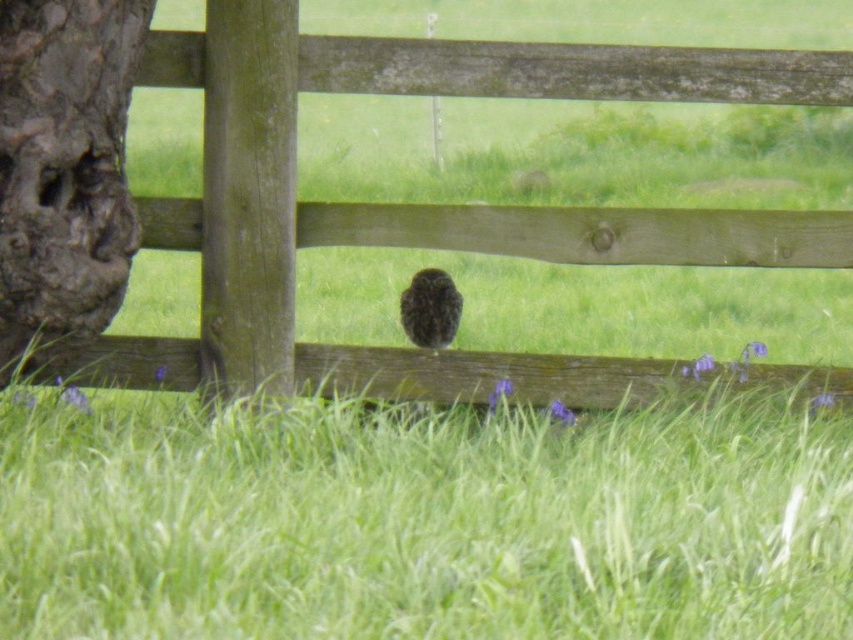
Question: Which point appears farthest from the camera in this image?

Choices:
 (A) (552, 541)
 (B) (447, 330)
 (C) (436, 376)
 (D) (93, 291)

Answer: (B)

Question: Is green grass at center to the left of rough bark tree trunk at left from the viewer's perspective?

Choices:
 (A) yes
 (B) no

Answer: (B)

Question: Which point is closer to the camera taking this photo?

Choices:
 (A) (369, 228)
 (B) (94, 76)
 (C) (440, 461)

Answer: (C)

Question: In this image, where is green grass at center located relative to rough bark tree trunk at left?

Choices:
 (A) above
 (B) below

Answer: (B)

Question: Can you confirm if wooden fence at center is smaller than dark brown owl at center?

Choices:
 (A) no
 (B) yes

Answer: (A)

Question: Which of the following is the closest to the observer?

Choices:
 (A) (47, 81)
 (B) (32, 513)
 (C) (421, 326)

Answer: (B)